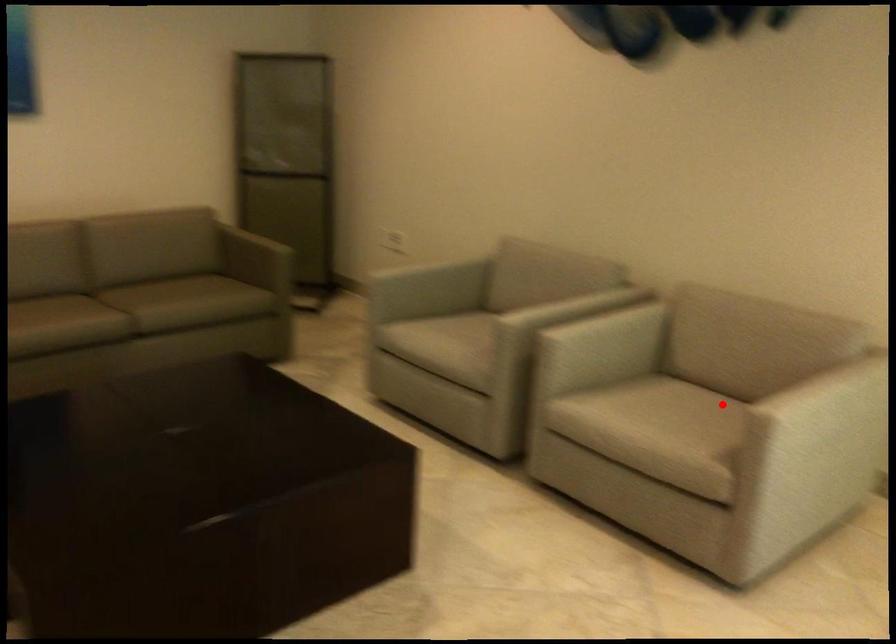
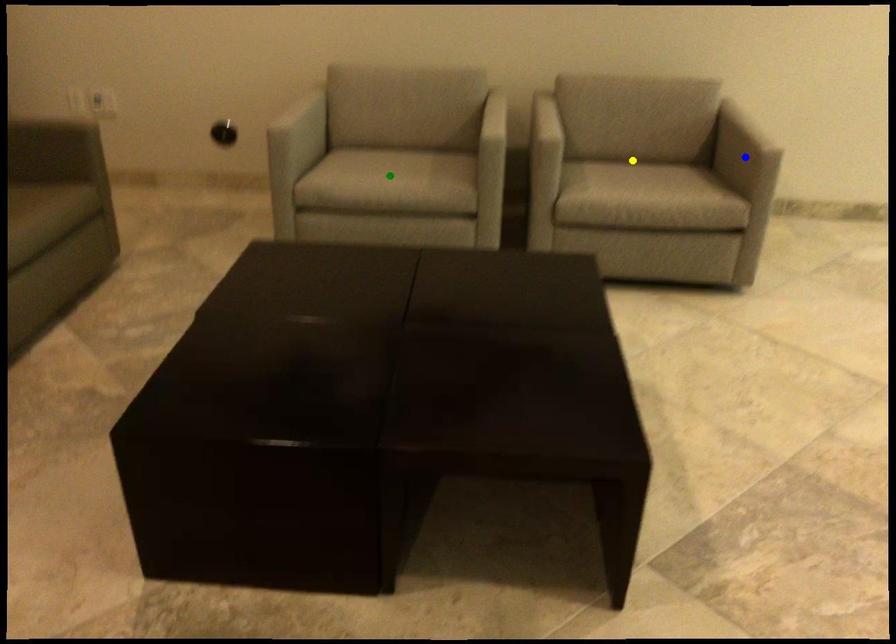
Question: I am providing you with two images of the same scene from different viewpoints. A red point is marked on the first image. You are given multiple points on the second image. Which point in image 2 represents the same 3d spot as the red point in image 1?

Choices:
 (A) blue point
 (B) yellow point
 (C) green point

Answer: (B)